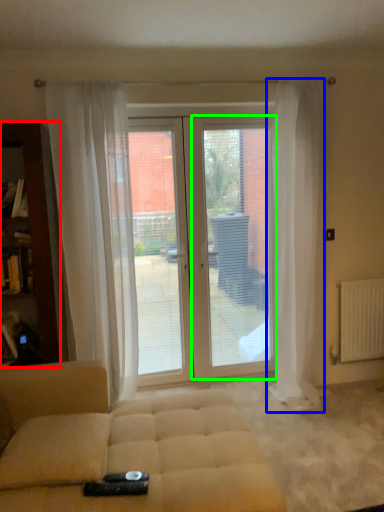
Question: Which object is the closest to the cabinetry (highlighted by a red box)? Choose among these: curtain (highlighted by a blue box) or screen door (highlighted by a green box).

Choices:
 (A) curtain
 (B) screen door

Answer: (B)